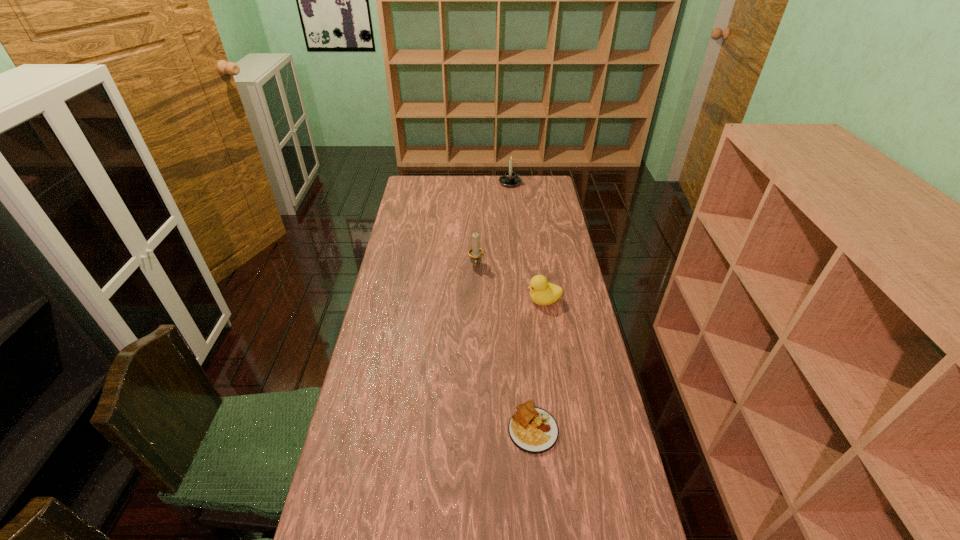
Identify which object is the second nearest to the third tallest object. Please provide its 2D coordinates. Your answer should be formatted as a tuple, i.e. [(x, y)], where the tuple contains the x and y coordinates of a point satisfying the conditions above.

[(533, 430)]

Choose which object is the third nearest neighbor to the duck. Please provide its 2D coordinates. Your answer should be formatted as a tuple, i.e. [(x, y)], where the tuple contains the x and y coordinates of a point satisfying the conditions above.

[(510, 179)]

Where is `free space that satisfies the following two spatial constraints: 1. on the handle side of the shortest object; 2. on the right side of the third nearest object`? The width and height of the screenshot is (960, 540). free space that satisfies the following two spatial constraints: 1. on the handle side of the shortest object; 2. on the right side of the third nearest object is located at coordinates (474, 428).

You are a GUI agent. You are given a task and a screenshot of the screen. Output one action in this format:
    pyautogui.click(x=<x>, y=<y>)
    Task: Click on the free point that satisfies the following two spatial constraints: 1. with a handle on the side of the right candle holder; 2. on the handle side of the nearer candle holder
    The height and width of the screenshot is (540, 960).
    Given the screenshot: What is the action you would take?
    pyautogui.click(x=518, y=266)

I want to click on vacant point that satisfies the following two spatial constraints: 1. on the handle side of the shortest object; 2. on the left side of the leftmost object, so pos(474,428).

This screenshot has width=960, height=540. I want to click on free location that satisfies the following two spatial constraints: 1. on the front-facing side of the duck; 2. on the front side of the nearest object, so click(564, 428).

In order to click on vacant space that satisfies the following two spatial constraints: 1. on the front-facing side of the duck; 2. on the front side of the shortest object in this screenshot , I will do `click(564, 428)`.

Where is `vacant space that satisfies the following two spatial constraints: 1. with a handle on the side of the right candle holder; 2. on the handle side of the third nearest object`? Image resolution: width=960 pixels, height=540 pixels. vacant space that satisfies the following two spatial constraints: 1. with a handle on the side of the right candle holder; 2. on the handle side of the third nearest object is located at coordinates (518, 266).